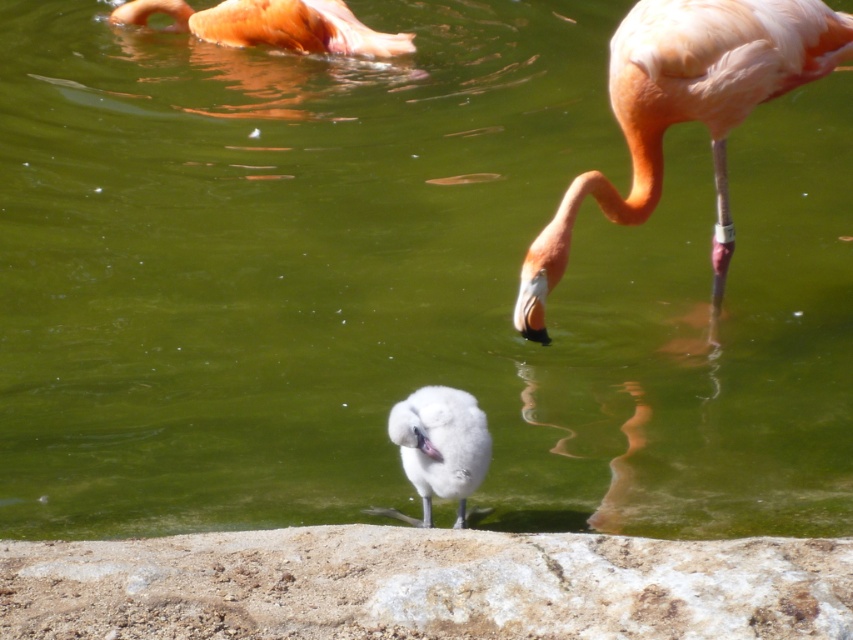
Question: Does matte pink flamingo at upper right appear on the left side of orange matte flamingo at upper left?

Choices:
 (A) yes
 (B) no

Answer: (B)

Question: Does matte pink flamingo at upper right appear on the left side of white fluffy bird at center?

Choices:
 (A) yes
 (B) no

Answer: (B)

Question: Which point is farther from the camera taking this photo?

Choices:
 (A) (380, 33)
 (B) (535, 289)

Answer: (A)

Question: Which point is farther to the camera?

Choices:
 (A) (225, 29)
 (B) (419, 400)

Answer: (A)

Question: Which object is farther from the camera taking this photo?

Choices:
 (A) matte pink flamingo at upper right
 (B) orange matte flamingo at upper left

Answer: (B)

Question: Can you confirm if matte pink flamingo at upper right is bigger than orange matte flamingo at upper left?

Choices:
 (A) yes
 (B) no

Answer: (A)